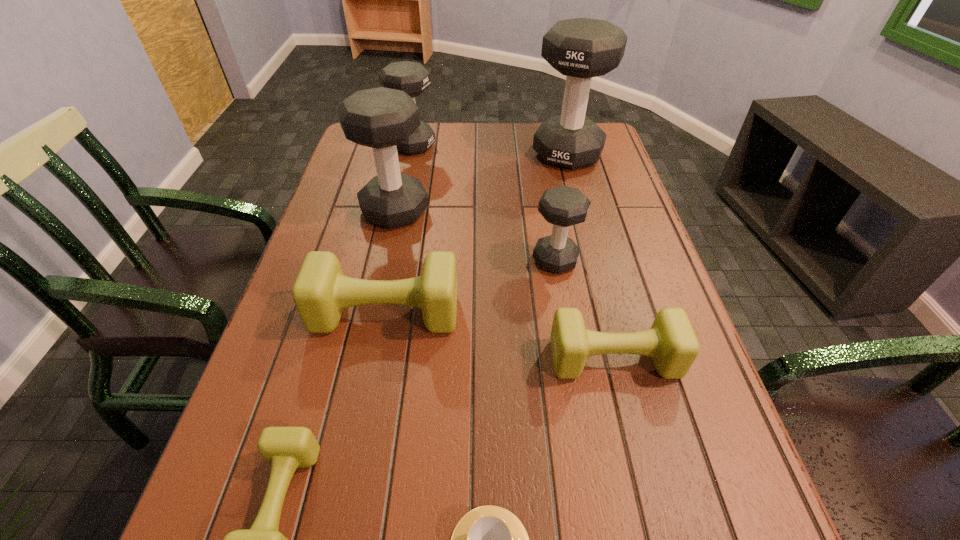
Find the location of a particular element. vacant space at the far edge of the desktop is located at coordinates (524, 152).

At what (x,y) coordinates should I click in order to perform the action: click on vacant space at the left edge. Please return your answer as a coordinate pair (x, y). The image size is (960, 540). Looking at the image, I should click on (359, 249).

Where is `free space at the right edge of the desktop`? This screenshot has width=960, height=540. free space at the right edge of the desktop is located at coordinates [x=631, y=217].

Locate an element on the screen. The width and height of the screenshot is (960, 540). blank region between the sixth farthest object and the second smallest gray dumbbell is located at coordinates (514, 252).

Image resolution: width=960 pixels, height=540 pixels. Identify the location of vacant area between the fifth nearest object and the fifth shortest dumbbell. (484, 203).

Locate an element on the screen. Image resolution: width=960 pixels, height=540 pixels. empty space that is in between the fifth farthest object and the fifth shortest dumbbell is located at coordinates (399, 229).

Image resolution: width=960 pixels, height=540 pixels. Identify the location of free space between the sixth tallest object and the fifth shortest dumbbell. (514, 252).

This screenshot has height=540, width=960. I want to click on free space between the fourth tallest object and the fifth shortest dumbbell, so [x=484, y=203].

Select which object is the third closest to the third tallest object. Please provide its 2D coordinates. Your answer should be formatted as a tuple, i.e. [(x, y)], where the tuple contains the x and y coordinates of a point satisfying the conditions above.

[(563, 206)]

Identify which object is located as the sixth nearest to the sixth farthest object. Please provide its 2D coordinates. Your answer should be formatted as a tuple, i.e. [(x, y)], where the tuple contains the x and y coordinates of a point satisfying the conditions above.

[(581, 48)]